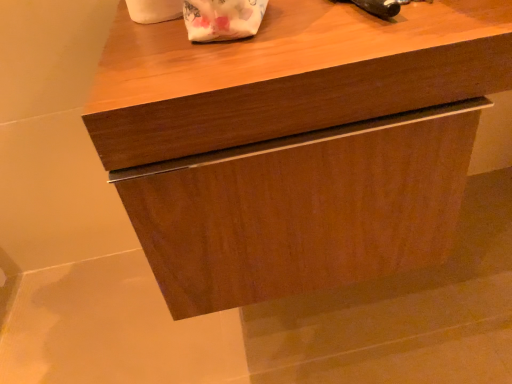
This screenshot has width=512, height=384. In order to click on wooden chest of drawers at center in this screenshot , I will do `click(296, 144)`.

What do you see at coordinates (296, 144) in the screenshot?
I see `wooden chest of drawers at center` at bounding box center [296, 144].

Where is `wooden chest of drawers at center`? Image resolution: width=512 pixels, height=384 pixels. wooden chest of drawers at center is located at coordinates (296, 144).